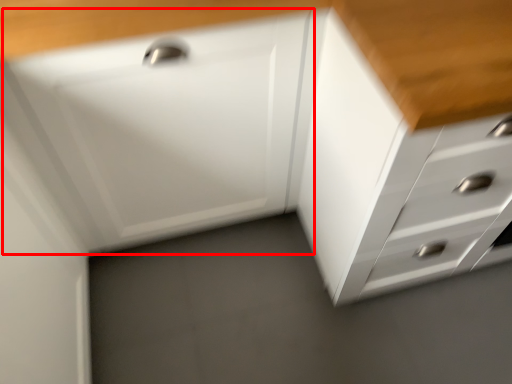
Question: From the image's perspective, considering the relative positions of drawer (annotated by the red box) and chest of drawers in the image provided, where is drawer (annotated by the red box) located with respect to the staircase?

Choices:
 (A) below
 (B) above

Answer: (B)